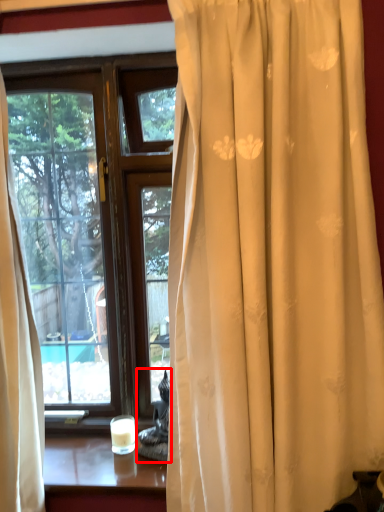
Question: From the image's perspective, where is chair (annotated by the red box) located in relation to candle holder in the image?

Choices:
 (A) below
 (B) above

Answer: (B)